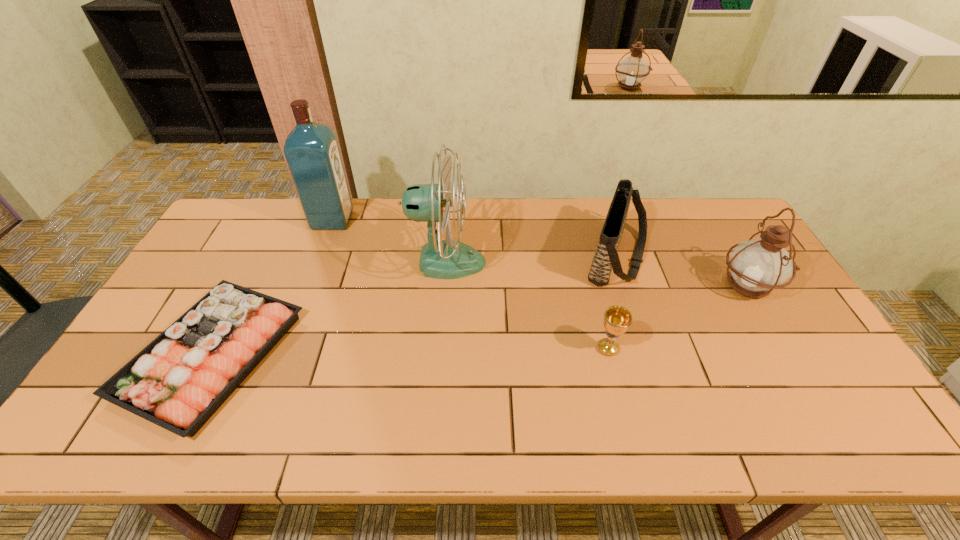
This screenshot has width=960, height=540. I want to click on vacant space at the far edge of the desktop, so click(475, 200).

The width and height of the screenshot is (960, 540). I want to click on vacant space at the near edge of the desktop, so click(x=478, y=425).

Locate an element on the screen. free space at the left edge of the desktop is located at coordinates [214, 278].

Where is `vacant space at the right edge of the desktop`? This screenshot has height=540, width=960. vacant space at the right edge of the desktop is located at coordinates (800, 372).

Find the location of a particular element. vacant space at the far right corner of the desktop is located at coordinates (701, 231).

Image resolution: width=960 pixels, height=540 pixels. I want to click on vacant area between the fan and the liquor, so click(390, 241).

Locate an element on the screen. Image resolution: width=960 pixels, height=540 pixels. vacant area between the platter and the second shortest object is located at coordinates (410, 352).

What are the coordinates of `vacant area that lies between the handbag and the third object from left to right` in the screenshot? It's located at (532, 260).

Find the location of a particular element. free space between the handbag and the liquor is located at coordinates (475, 239).

Identify the location of free space between the liquor and the second shortest object. (470, 284).